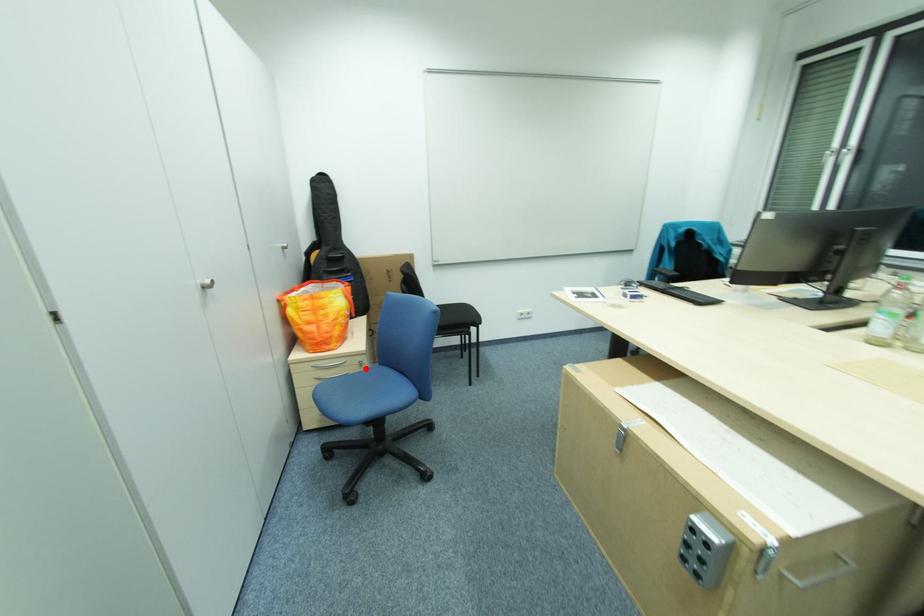
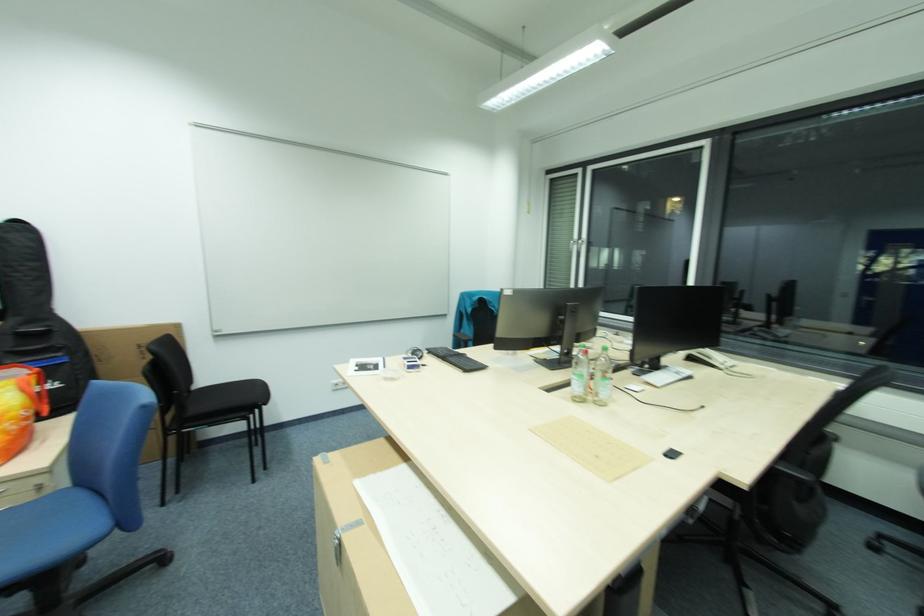
Question: I am providing you with two images of the same scene from different viewpoints. In image1, a red point is highlighted. Considering the same 3D point in image2, which of the following is correct?

Choices:
 (A) It is closer
 (B) It is farther

Answer: (A)